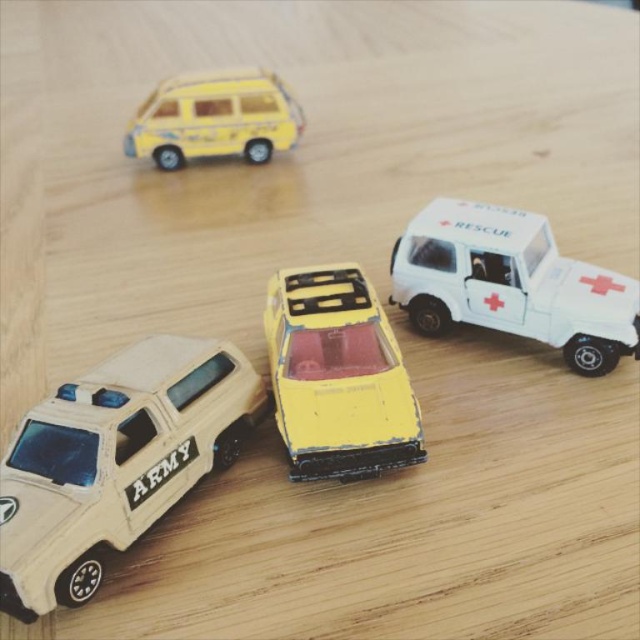
You are a GUI agent. You are given a task and a screenshot of the screen. Output one action in this format:
    pyautogui.click(x=<x>, y=<y>)
    Task: Click on the tan matte/wooden army vehicle at lower left
    The height and width of the screenshot is (640, 640).
    Given the screenshot: What is the action you would take?
    pyautogui.click(x=115, y=461)

Describe the element at coordinates (115, 461) in the screenshot. I see `tan matte/wooden army vehicle at lower left` at that location.

Identify the location of tan matte/wooden army vehicle at lower left. (115, 461).

Identify the location of tan matte/wooden army vehicle at lower left. The width and height of the screenshot is (640, 640). (115, 461).

Can you confirm if tan matte/wooden army vehicle at lower left is wider than yellow matte car at center?

Yes.

Find the location of a particular element. tan matte/wooden army vehicle at lower left is located at coordinates (115, 461).

Is white matte rescue car at upper right positioned behind yellow matte van at upper left?

No.

The height and width of the screenshot is (640, 640). Find the location of `white matte rescue car at upper right`. white matte rescue car at upper right is located at coordinates (512, 284).

At what (x,y) coordinates should I click in order to perform the action: click on white matte rescue car at upper right. Please return your answer as a coordinate pair (x, y). Image resolution: width=640 pixels, height=640 pixels. Looking at the image, I should click on click(x=512, y=284).